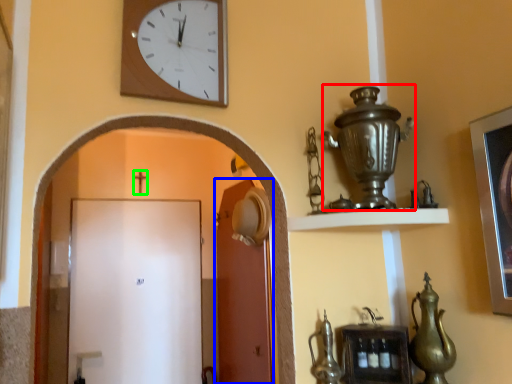
Question: Which object is the closest to the candle holder (highlighted by a red box)? Choose among these: door (highlighted by a blue box) or crucifix (highlighted by a green box).

Choices:
 (A) door
 (B) crucifix

Answer: (A)